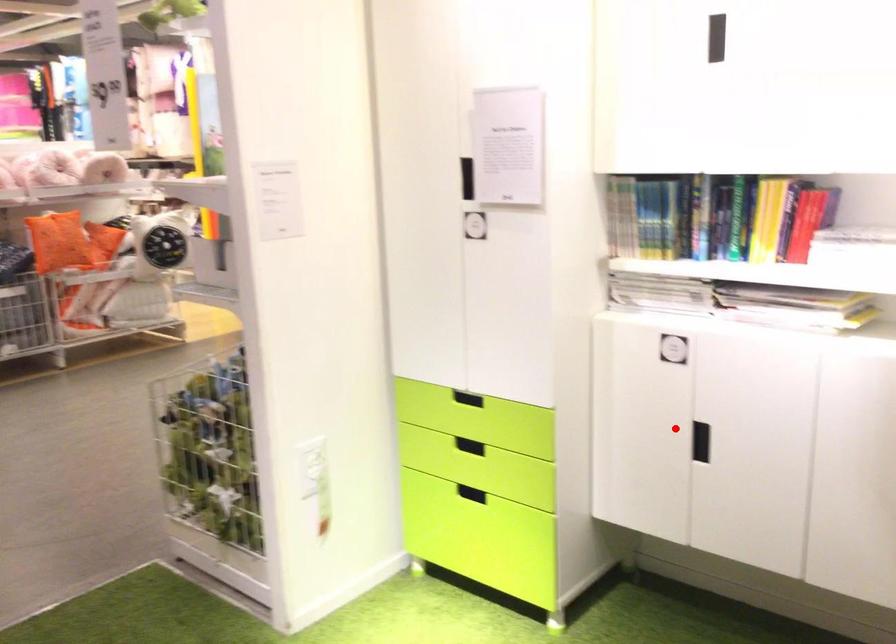
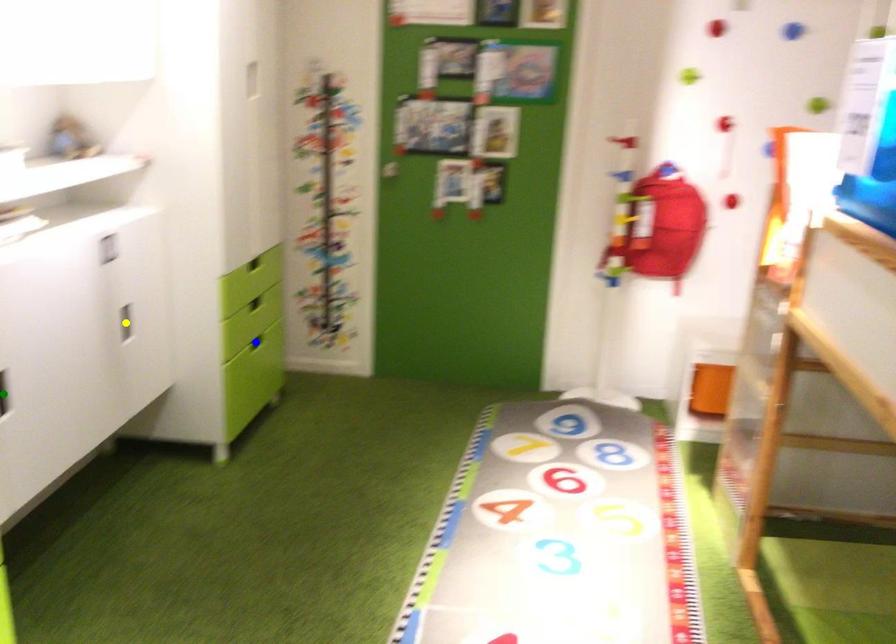
Question: I am providing you with two images of the same scene from different viewpoints. A red point is marked on the first image. You are given multiple points on the second image. Which mark in image 2 goes with the point in image 1?

Choices:
 (A) yellow point
 (B) blue point
 (C) green point

Answer: (C)